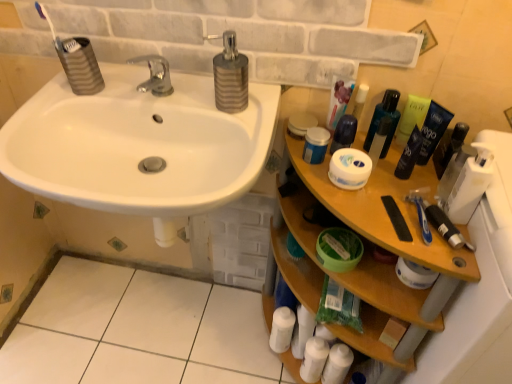
You are a GUI agent. You are given a task and a screenshot of the screen. Output one action in this format:
    pyautogui.click(x=<x>, y=<y>)
    Task: Click on the free location to the left of silver metallic soap dispenser at upper center
    This screenshot has width=512, height=384.
    Given the screenshot: What is the action you would take?
    pyautogui.click(x=177, y=99)